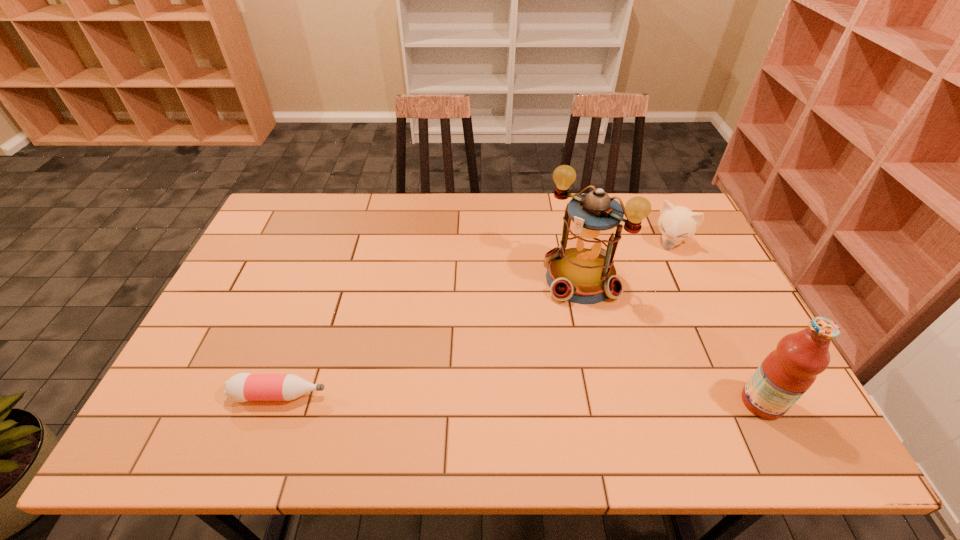
This screenshot has width=960, height=540. I want to click on free space that satisfies the following two spatial constraints: 1. on the front side of the third shortest object; 2. on the front label of the tallest object, so click(609, 402).

The width and height of the screenshot is (960, 540). Find the location of `vacant region that satisfies the following two spatial constraints: 1. on the front side of the kitten; 2. on the front label of the second tallest object`. vacant region that satisfies the following two spatial constraints: 1. on the front side of the kitten; 2. on the front label of the second tallest object is located at coordinates (745, 402).

This screenshot has height=540, width=960. Find the location of `vacant space that satisfies the following two spatial constraints: 1. on the front side of the kitten; 2. on the front label of the third shortest object`. vacant space that satisfies the following two spatial constraints: 1. on the front side of the kitten; 2. on the front label of the third shortest object is located at coordinates (745, 402).